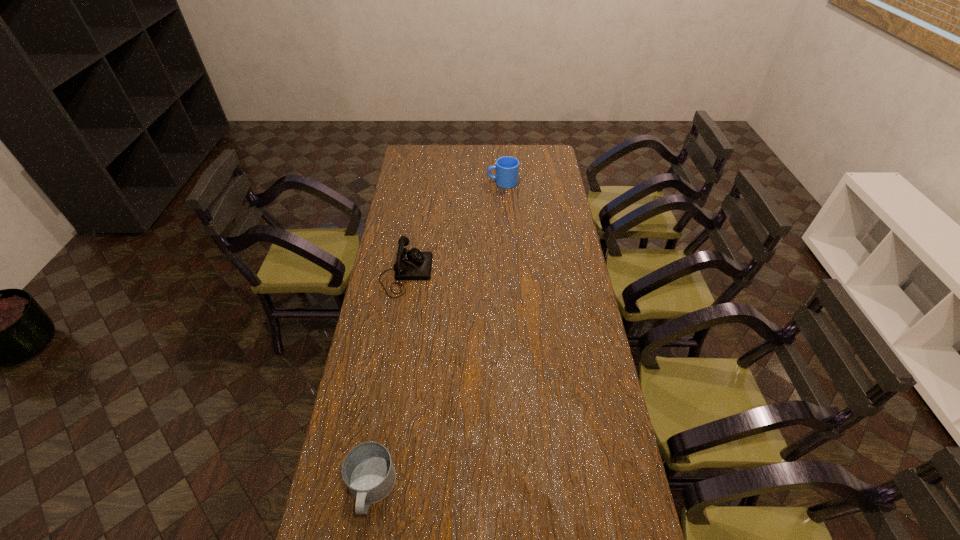
You are a GUI agent. You are given a task and a screenshot of the screen. Output one action in this format:
    pyautogui.click(x=<x>, y=<y>)
    Task: Click on the mug located in the left edge section of the desktop
    This screenshot has width=960, height=540.
    Given the screenshot: What is the action you would take?
    pyautogui.click(x=367, y=470)

The image size is (960, 540). I want to click on vacant space at the far edge, so click(x=441, y=148).

This screenshot has height=540, width=960. What are the coordinates of `vacant region at the left edge of the desktop` in the screenshot? It's located at (413, 182).

This screenshot has width=960, height=540. I want to click on vacant space at the right edge of the desktop, so click(x=542, y=211).

The height and width of the screenshot is (540, 960). Find the location of `empty space that is in between the farther mug and the nearer mug`. empty space that is in between the farther mug and the nearer mug is located at coordinates (437, 335).

Locate an element on the screen. The image size is (960, 540). vacant space in between the nearest object and the right mug is located at coordinates (437, 335).

Locate an element on the screen. The width and height of the screenshot is (960, 540). blank region between the shorter mug and the farther mug is located at coordinates (437, 335).

I want to click on empty space between the right mug and the shorter mug, so click(x=437, y=335).

Where is `empty space that is in between the nearer mug and the farther mug`? The image size is (960, 540). empty space that is in between the nearer mug and the farther mug is located at coordinates (437, 335).

This screenshot has width=960, height=540. Find the location of `vacant space that is in between the second farthest object and the nearest object`. vacant space that is in between the second farthest object and the nearest object is located at coordinates (389, 381).